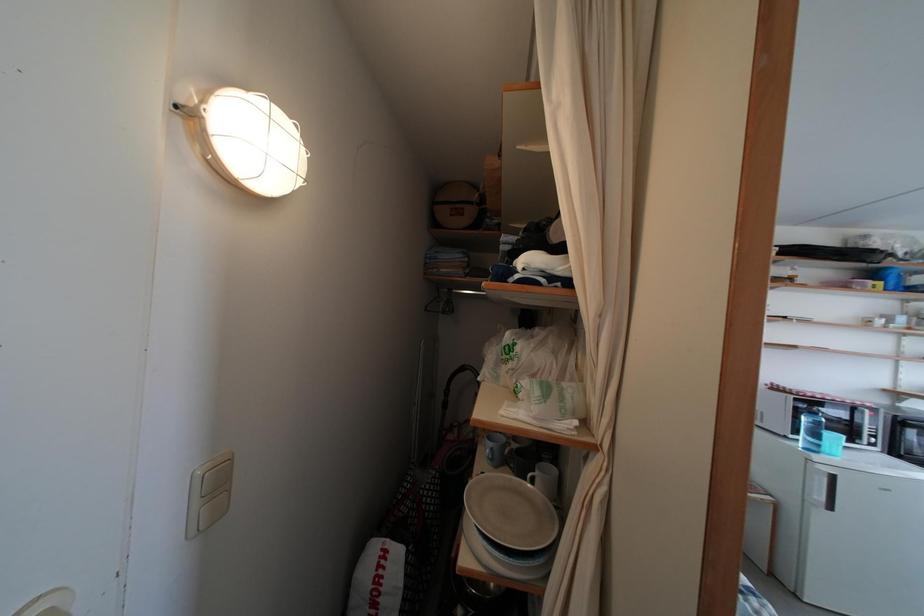
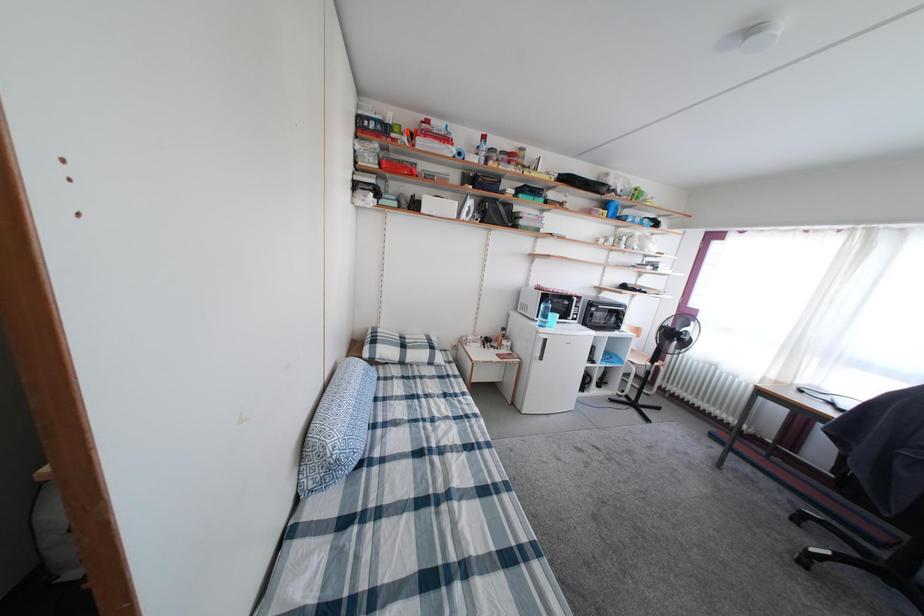
How did the camera likely rotate?

The rotation direction of the camera is right-down.